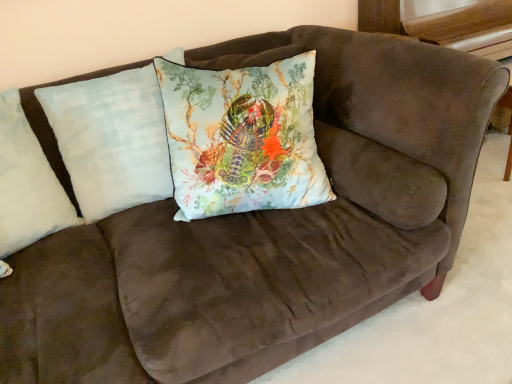
Question: Does white soft pillow at left, the first pillow viewed from the left, have a greater width compared to light blue fabric pillow at center, positioned as the second pillow in left-to-right order?

Choices:
 (A) yes
 (B) no

Answer: (A)

Question: Does white soft pillow at left, the first pillow viewed from the left, lie behind light blue fabric pillow at center, positioned as the second pillow in left-to-right order?

Choices:
 (A) no
 (B) yes

Answer: (A)

Question: Is white soft pillow at left, the first pillow viewed from the left, to the right of light blue fabric pillow at center, positioned as the second pillow in left-to-right order, from the viewer's perspective?

Choices:
 (A) yes
 (B) no

Answer: (B)

Question: Would you say white soft pillow at left, arranged as the third pillow when viewed from the right, is outside light blue fabric pillow at center, positioned as the second pillow in left-to-right order?

Choices:
 (A) yes
 (B) no

Answer: (A)

Question: Does white soft pillow at left, the first pillow viewed from the left, have a lesser width compared to light blue fabric pillow at center, arranged as the 2th pillow when viewed from the right?

Choices:
 (A) yes
 (B) no

Answer: (B)

Question: Considering their positions, is white soft pillow at left, arranged as the third pillow when viewed from the right, located in front of or behind light blue fabric pillow at center, positioned as the second pillow in left-to-right order?

Choices:
 (A) behind
 (B) front

Answer: (B)

Question: Considering the positions of point (27, 168) and point (118, 173), is point (27, 168) closer or farther from the camera than point (118, 173)?

Choices:
 (A) farther
 (B) closer

Answer: (B)

Question: Is white soft pillow at left, the first pillow viewed from the left, to the left or to the right of light blue fabric pillow at center, arranged as the 2th pillow when viewed from the right, in the image?

Choices:
 (A) left
 (B) right

Answer: (A)

Question: From a real-world perspective, relative to light blue fabric pillow at center, positioned as the second pillow in left-to-right order, is white soft pillow at left, arranged as the third pillow when viewed from the right, vertically above or below?

Choices:
 (A) above
 (B) below

Answer: (A)

Question: Considering the positions of light blue fabric pillow at center, positioned as the second pillow in left-to-right order, and white soft pillow at left, arranged as the third pillow when viewed from the right, in the image, is light blue fabric pillow at center, positioned as the second pillow in left-to-right order, wider or thinner than white soft pillow at left, arranged as the third pillow when viewed from the right,?

Choices:
 (A) thin
 (B) wide

Answer: (A)

Question: Is light blue fabric pillow at center, positioned as the second pillow in left-to-right order, taller or shorter than white soft pillow at left, the first pillow viewed from the left?

Choices:
 (A) short
 (B) tall

Answer: (B)

Question: From the image's perspective, relative to white soft pillow at left, arranged as the third pillow when viewed from the right, is light blue fabric pillow at center, positioned as the second pillow in left-to-right order, above or below?

Choices:
 (A) below
 (B) above

Answer: (B)

Question: Is light blue fabric pillow at center, arranged as the 2th pillow when viewed from the right, spatially inside white soft pillow at left, arranged as the third pillow when viewed from the right, or outside of it?

Choices:
 (A) inside
 (B) outside

Answer: (B)

Question: Is light blue fabric pillow at center, the third pillow in the left-to-right sequence, inside or outside of light blue fabric pillow at center, arranged as the 2th pillow when viewed from the right?

Choices:
 (A) inside
 (B) outside

Answer: (B)

Question: Considering the positions of light blue fabric pillow at center, the third pillow in the left-to-right sequence, and light blue fabric pillow at center, positioned as the second pillow in left-to-right order, in the image, is light blue fabric pillow at center, the third pillow in the left-to-right sequence, wider or thinner than light blue fabric pillow at center, positioned as the second pillow in left-to-right order,?

Choices:
 (A) wide
 (B) thin

Answer: (A)